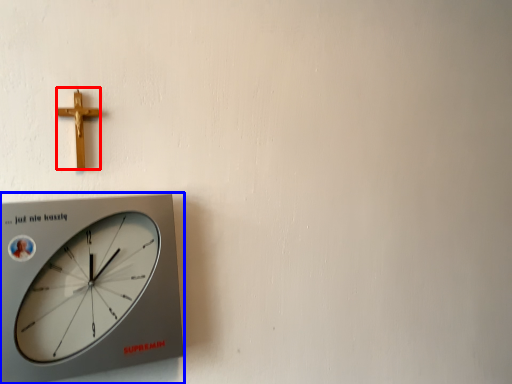
Question: Among these objects, which one is farthest to the camera, crucifix (highlighted by a red box) or wall clock (highlighted by a blue box)?

Choices:
 (A) crucifix
 (B) wall clock

Answer: (A)